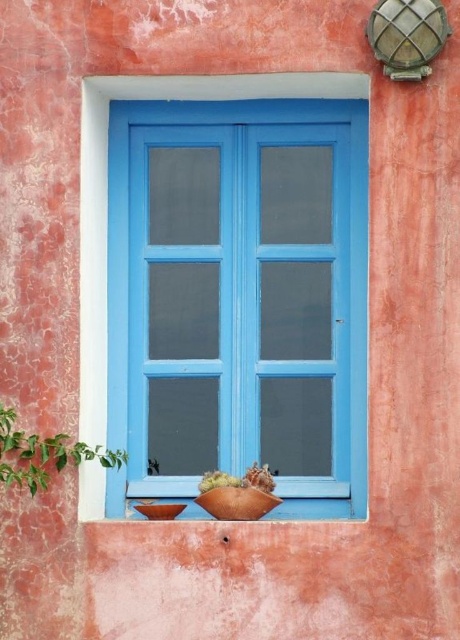
You are an interior designer arranging items on a window ledge. You have a green leafy plant at lower left and a matte brown pot at lower center. Which item is located to the left of the other?

The green leafy plant at lower left is positioned on the left side of the matte brown pot at lower center, so it is to the left of the pot.

You are an architect designing a new garden layout. You need to place a new plant exactly at the same coordinates as the green leafy plant at lower left. What are the coordinates where you should place the new plant?

The coordinates for the green leafy plant at lower left are at point (x=44, y=454), so you should place the new plant at those coordinates.